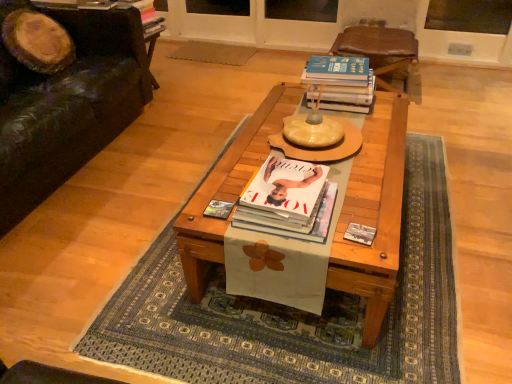
The width and height of the screenshot is (512, 384). I want to click on free space in front of matte yellow round table at center, so click(354, 192).